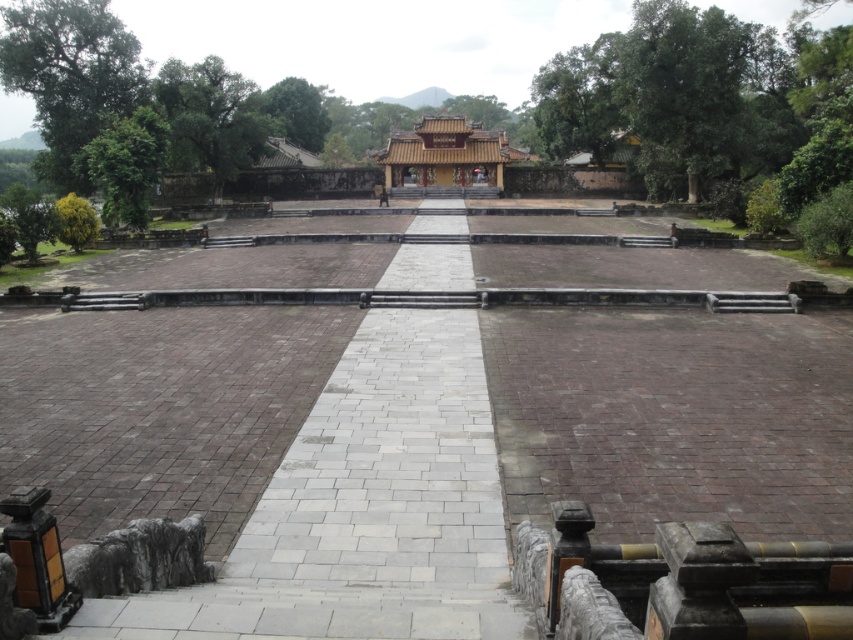
Which of these two, gray stone path at center or golden lacquered palace at center, stands shorter?

gray stone path at center

Locate an element on the screen. gray stone path at center is located at coordinates 364,509.

What do you see at coordinates (364, 509) in the screenshot? This screenshot has height=640, width=853. I see `gray stone path at center` at bounding box center [364, 509].

At what (x,y) coordinates should I click in order to perform the action: click on gray stone path at center. Please return your answer as a coordinate pair (x, y). Looking at the image, I should click on (364, 509).